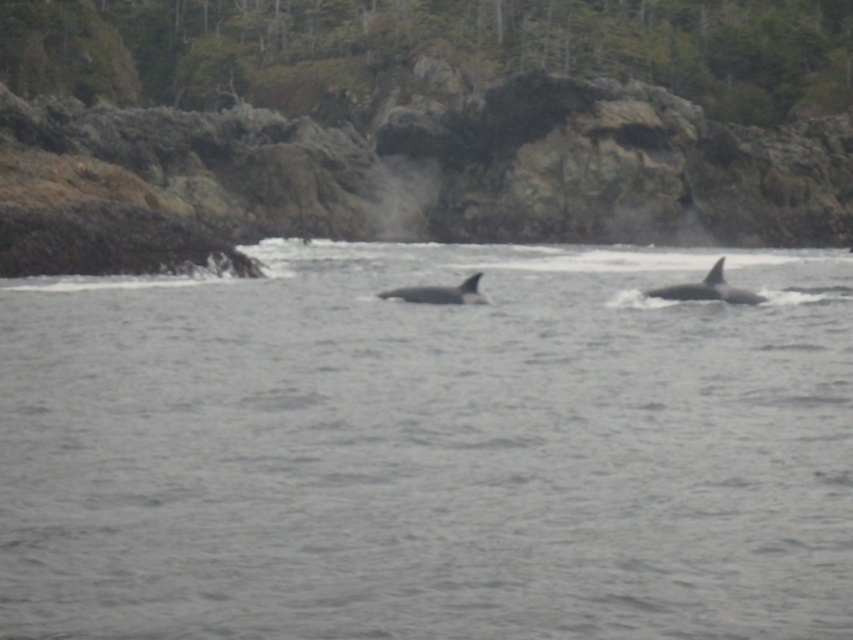
Question: Which object is positioned farthest from the black smooth whale at right?

Choices:
 (A) gray water at center
 (B) black smooth whale at center

Answer: (A)

Question: Where is black smooth whale at right located in relation to black smooth whale at center in the image?

Choices:
 (A) below
 (B) above

Answer: (B)

Question: Can you confirm if black smooth whale at right is positioned below black smooth whale at center?

Choices:
 (A) no
 (B) yes

Answer: (A)

Question: Which of the following is the closest to the observer?

Choices:
 (A) (432, 300)
 (B) (718, 259)

Answer: (B)

Question: Does gray water at center have a greater width compared to black smooth whale at center?

Choices:
 (A) no
 (B) yes

Answer: (B)

Question: Among these points, which one is nearest to the camera?

Choices:
 (A) (213, 492)
 (B) (477, 296)

Answer: (A)